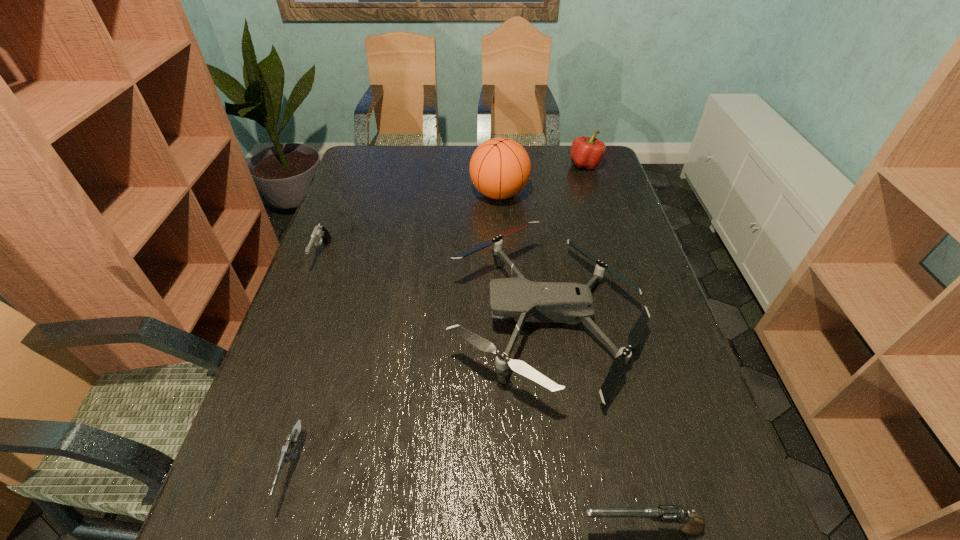
Where is `free space located on the right of the tallest object`? The image size is (960, 540). free space located on the right of the tallest object is located at coordinates (580, 193).

Find the location of a particular element. This screenshot has height=540, width=960. free space located 0.090m on the left of the farthest object is located at coordinates (544, 165).

Identify the location of vacant space situated 0.370m on the front-facing side of the drone. (300, 319).

Find the location of `vacant area located on the front-facing side of the drone`. vacant area located on the front-facing side of the drone is located at coordinates (345, 319).

I want to click on vacant space located 0.220m on the front-facing side of the drone, so click(361, 319).

Identify the location of free region located 0.270m at the muzzle of the farthest gun. (284, 357).

You are a GUI agent. You are given a task and a screenshot of the screen. Output one action in this format:
    pyautogui.click(x=<x>, y=<y>)
    Task: Click on the vacant space located aiming along the barrel of the nearest object
    The image size is (960, 540).
    Given the screenshot: What is the action you would take?
    pyautogui.click(x=433, y=529)

Find the location of `vacant position located 0.160m aiming along the barrel of the nearest object`. vacant position located 0.160m aiming along the barrel of the nearest object is located at coordinates (486, 529).

Where is `vacant area located aiming along the barrel of the nearest object`? The height and width of the screenshot is (540, 960). vacant area located aiming along the barrel of the nearest object is located at coordinates pyautogui.click(x=433, y=529).

I want to click on basketball present at the far edge, so click(500, 168).